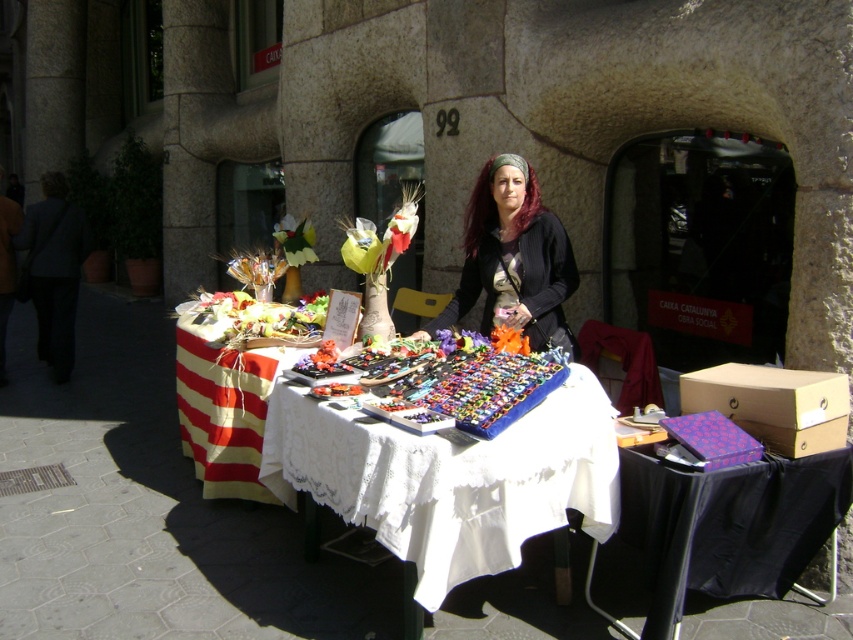
You are a customer at the outdoor market and want to buy the purple fabric flower at center. The vendor tells you that the flower is placed on the white lace tablecloth at center. Can you determine which object is larger in size?

The white lace tablecloth at center has a larger size compared to the purple fabric flower at center, so the white lace tablecloth at center is larger.

You are standing at the center of the market and see the red striped fabric at lower left. Can you determine its exact position relative to the center of the market?

The red striped fabric at lower left is located at point 0.631 on the x axis and 0.263 on the y axis.